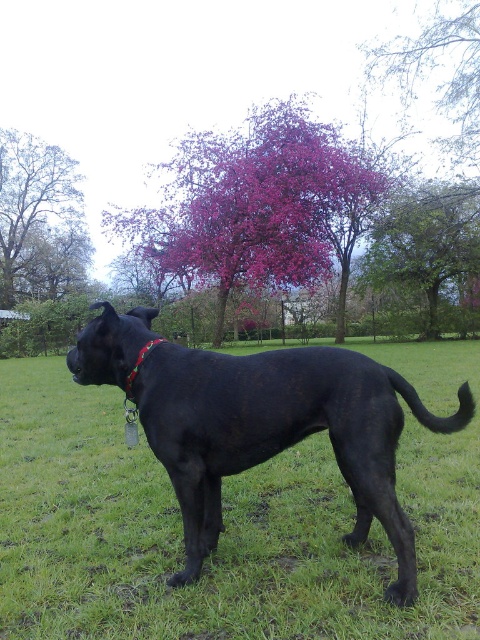
Is black glossy dog at center above green leafy tree at upper center?

Actually, black glossy dog at center is below green leafy tree at upper center.

Image resolution: width=480 pixels, height=640 pixels. Describe the element at coordinates (282, 433) in the screenshot. I see `black glossy dog at center` at that location.

Does point (264, 403) lie behind point (420, 227)?

No.

This screenshot has height=640, width=480. In order to click on black glossy dog at center in this screenshot , I will do `click(282, 433)`.

Between smooth bark tree at upper left and red fabric neckband at center, which one appears on the right side from the viewer's perspective?

red fabric neckband at center is more to the right.

The height and width of the screenshot is (640, 480). I want to click on smooth bark tree at upper left, so click(39, 220).

Is point (351, 369) farther from camera compared to point (424, 40)?

No, (351, 369) is closer to viewer.

Can you confirm if black glossy dog at center is smaller than purple leafy tree at upper center?

Yes.

Find the location of a particular element. This screenshot has width=480, height=640. black glossy dog at center is located at coordinates click(282, 433).